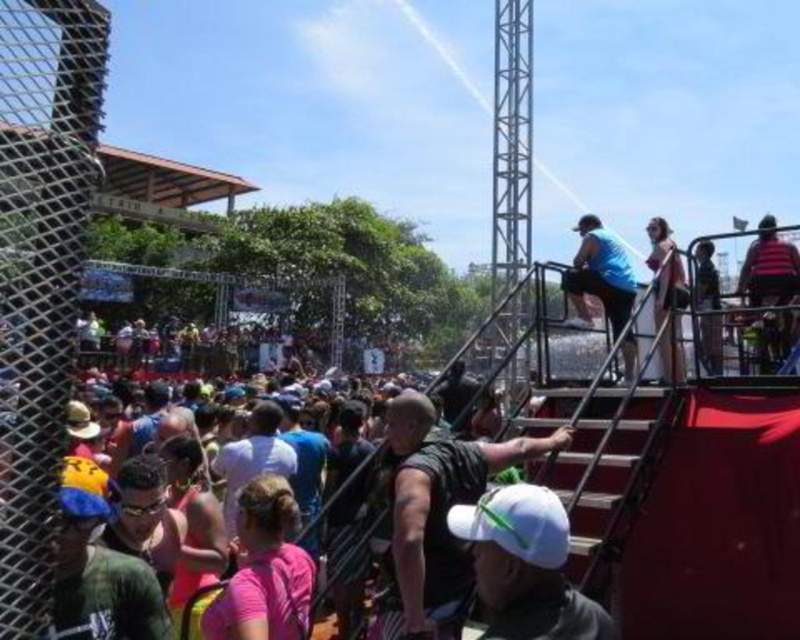
Question: Is pink fabric shirt at center below blue matte shirt at upper right?

Choices:
 (A) yes
 (B) no

Answer: (A)

Question: Based on their relative distances, which object is farther from the striped fabric shirt at upper right?

Choices:
 (A) dark blue shirt at upper right
 (B) white matte baseball cap at lower center
 (C) black mesh shirt at center
 (D) white fabric dress at upper right

Answer: (B)

Question: Which of the following is the closest to the observer?

Choices:
 (A) (509, 484)
 (B) (700, 288)
 (C) (656, 294)

Answer: (A)

Question: Does black mesh shirt at center have a larger size compared to pink fabric shirt at center?

Choices:
 (A) yes
 (B) no

Answer: (A)

Question: Is white matte baseball cap at lower center smaller than white fabric dress at upper right?

Choices:
 (A) yes
 (B) no

Answer: (A)

Question: Which of the following is the closest to the observer?

Choices:
 (A) (762, 292)
 (B) (562, 429)
 (C) (576, 289)
 (D) (721, 339)

Answer: (B)